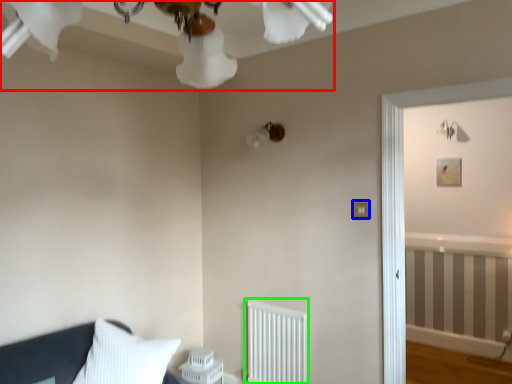
Question: Which object is the closest to the light fixture (highlighted by a red box)? Choose among these: light switch (highlighted by a blue box) or radiator (highlighted by a green box).

Choices:
 (A) light switch
 (B) radiator

Answer: (A)